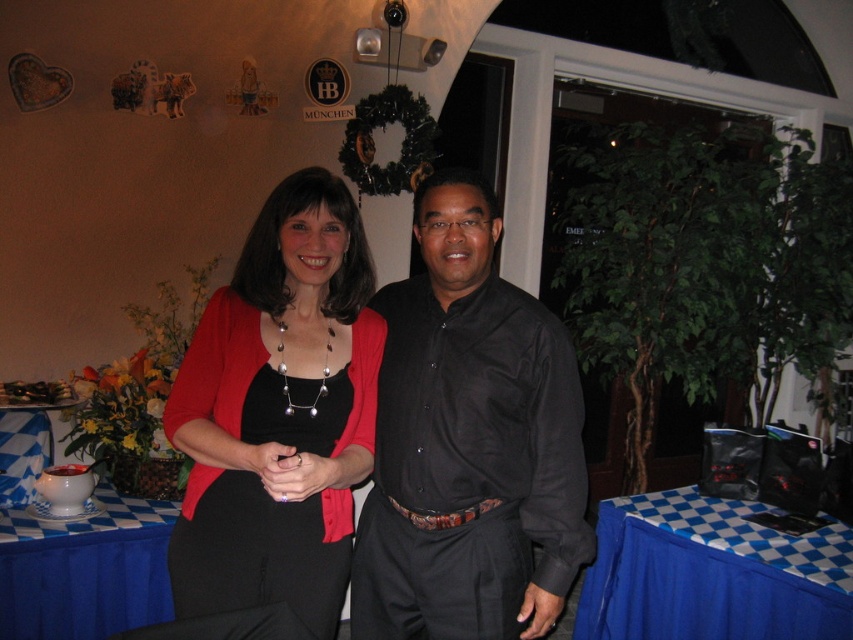
Question: Which object is the closest to the black satin dress at center?

Choices:
 (A) matte black dress at center
 (B) white ceramic bowl at lower left
 (C) blue checkered tablecloth at lower right

Answer: (A)

Question: Is black satin dress at center positioned at the back of white ceramic bowl at lower left?

Choices:
 (A) no
 (B) yes

Answer: (A)

Question: Can you confirm if blue checkered tablecloth at lower right is positioned below black satin dress at center?

Choices:
 (A) no
 (B) yes

Answer: (B)

Question: In this image, where is matte black dress at center located relative to black satin dress at center?

Choices:
 (A) below
 (B) above

Answer: (B)

Question: Which object is farther from the camera taking this photo?

Choices:
 (A) white ceramic bowl at lower left
 (B) black satin shirt at center
 (C) blue checkered tablecloth at lower right
 (D) black satin dress at center

Answer: (C)

Question: Which of these objects is positioned closest to the blue checkered tablecloth at lower right?

Choices:
 (A) white ceramic bowl at lower left
 (B) black satin shirt at center

Answer: (B)